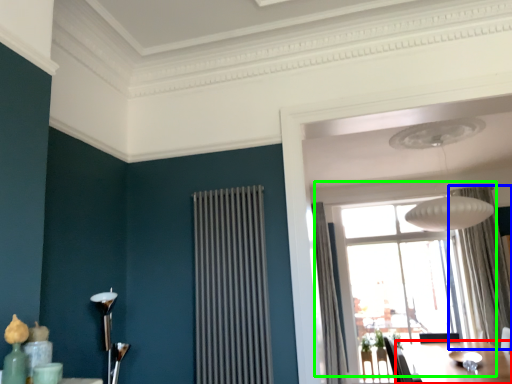
Question: Which object is the farthest from table (highlighted by a red box)? Choose among these: curtain (highlighted by a blue box) or window (highlighted by a green box).

Choices:
 (A) curtain
 (B) window

Answer: (B)